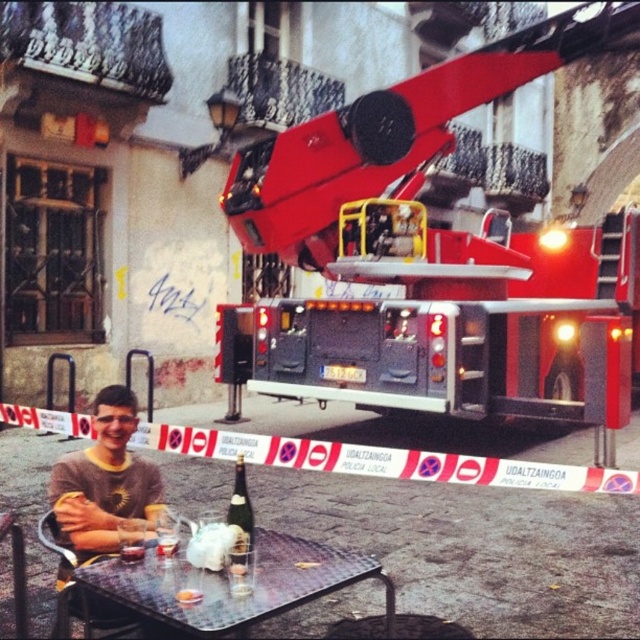
You are at the outdoor table in the scene and want to locate the shiny red fire truck at upper right. What are the coordinates where you can find it?

The coordinates for the shiny red fire truck at upper right are at point (440, 237).

You are a waiter at the cafe and need to place a new menu on the table. The menu is 15 cm wide. Can you fit it on the metallic silver table at center without overlapping the matte glass bottle at table center?

The metallic silver table at center is positioned on the right side of the matte glass bottle at table center. Since the table is to the right of the bottle, there should be enough space on the left side of the bottle to place the menu without overlapping. However, the exact available space isn generated in the description. Without specific measurements, it is uncertain if the 15 cm width will fit. Please check the actual distance between the bottle and the edge of the table.